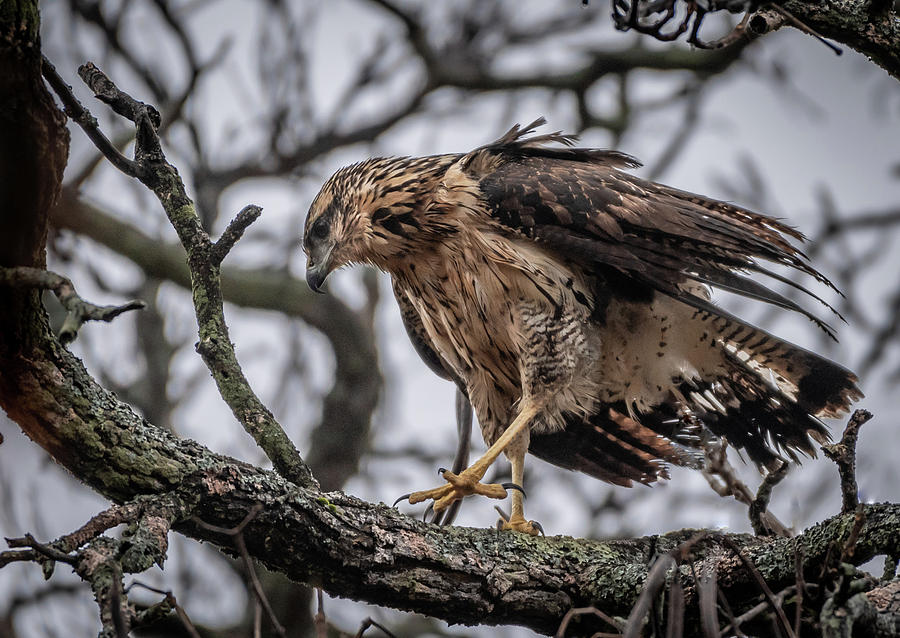
Image resolution: width=900 pixels, height=638 pixels. I want to click on chest, so click(x=438, y=298).